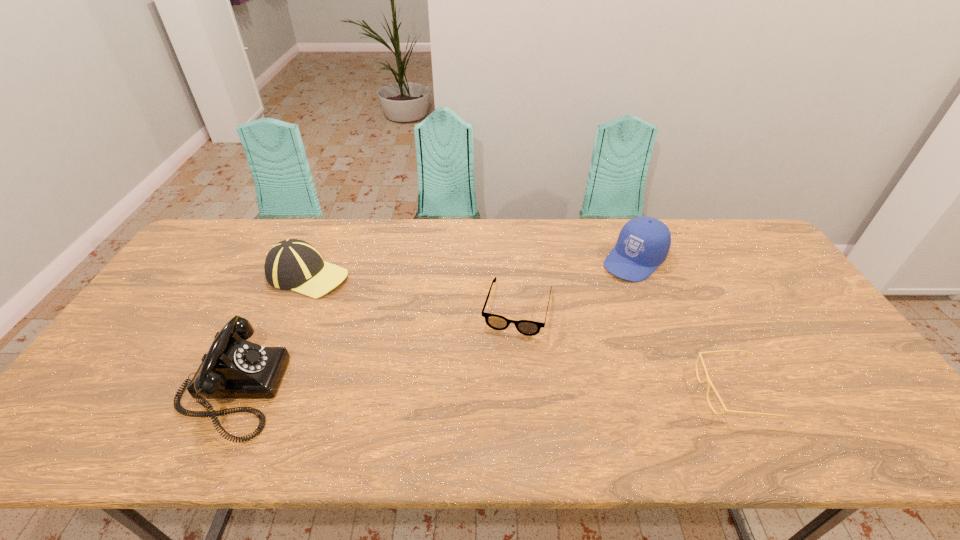
The image size is (960, 540). Find the location of `vacant region between the baseball cap and the cap`. vacant region between the baseball cap and the cap is located at coordinates (471, 268).

At what (x,y) coordinates should I click in order to perform the action: click on free space between the left spectacles and the cap. Please return your answer as a coordinate pair (x, y). This screenshot has height=540, width=960. Looking at the image, I should click on (576, 285).

Where is `free space between the nearer spectacles and the left spectacles`? The width and height of the screenshot is (960, 540). free space between the nearer spectacles and the left spectacles is located at coordinates (625, 351).

Locate an element on the screen. vacant space that is in between the baseball cap and the right spectacles is located at coordinates (520, 334).

Locate an element on the screen. free space that is in between the cap and the telephone is located at coordinates (432, 325).

The image size is (960, 540). Find the location of `free space between the right spectacles and the cap`. free space between the right spectacles and the cap is located at coordinates (684, 326).

Image resolution: width=960 pixels, height=540 pixels. I want to click on empty location between the cap and the third shortest object, so click(471, 268).

At what (x,y) coordinates should I click in order to perform the action: click on free space between the cap and the nearer spectacles. Please return your answer as a coordinate pair (x, y). The height and width of the screenshot is (540, 960). Looking at the image, I should click on (684, 326).

The height and width of the screenshot is (540, 960). Find the location of `free space between the telephone and the farther spectacles`. free space between the telephone and the farther spectacles is located at coordinates (374, 350).

Locate an element on the screen. object that is the closest one to the telephone is located at coordinates (292, 264).